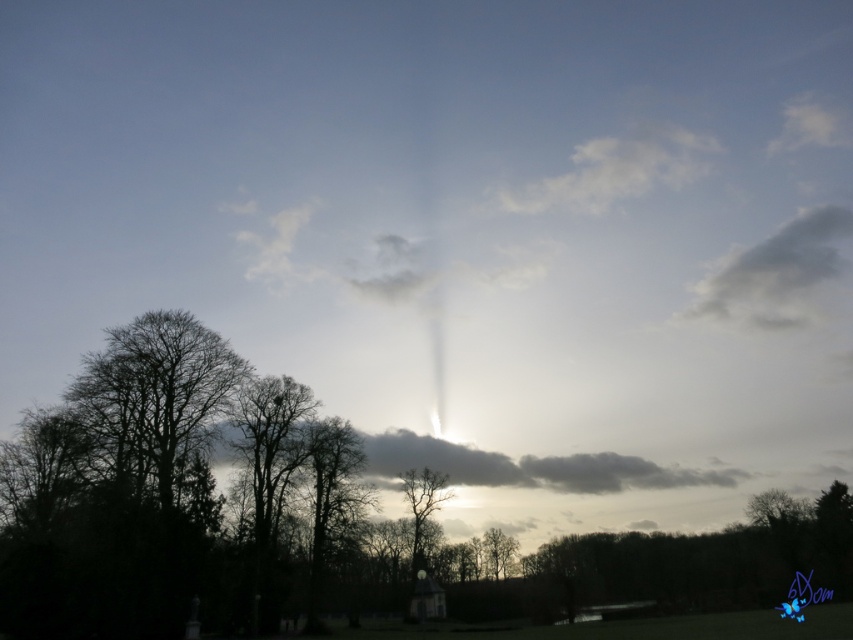
Does point (715, 536) come closer to viewer compared to point (123, 340)?

No, (715, 536) is further to viewer.

Can you confirm if green leafy tree at center is positioned above silhouette bare tree at left?

No.

Measure the distance between green leafy tree at center and camera.

green leafy tree at center and camera are 43.90 meters apart from each other.

The width and height of the screenshot is (853, 640). What are the coordinates of `green leafy tree at center` in the screenshot? It's located at (187, 500).

Is green leafy tree at center behind silhouette bare tree at center?

That is False.

Can you confirm if green leafy tree at center is shorter than silhouette bare tree at center?

No.

Between point (144, 588) and point (424, 481), which one is positioned in front?

Point (144, 588) is more forward.

Identify the location of green leafy tree at center. (187, 500).

Between green leafy tree at center and gray fluffy cloud at upper right, which one has more height?

With more height is green leafy tree at center.

Which is above, green leafy tree at center or gray fluffy cloud at upper right?

Positioned higher is gray fluffy cloud at upper right.

Locate an element on the screen. The height and width of the screenshot is (640, 853). green leafy tree at center is located at coordinates (187, 500).